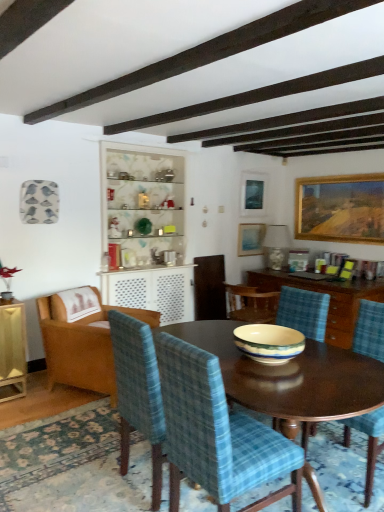
Question: Is white fabric lampshade at upper center taller or shorter than wooden cabinet at center?

Choices:
 (A) short
 (B) tall

Answer: (A)

Question: From a real-world perspective, is white fabric lampshade at upper center physically located above or below wooden cabinet at center?

Choices:
 (A) above
 (B) below

Answer: (A)

Question: Which is farther from the wooden table at center?

Choices:
 (A) blue plaid chair at center, the third chair from the left
 (B) wooden cabinet at center
 (C) white fabric lampshade at upper center
 (D) porcelain bowl at center
 (E) blue plaid chair at center, the 4th chair from the left

Answer: (C)

Question: Which object is positioned farthest from the blue plaid chair at center, the 4th chair from the left?

Choices:
 (A) white fabric lampshade at upper center
 (B) blue plaid chair at center, the third chair from the left
 (C) wooden armchair at left, the first chair viewed from the left
 (D) wooden table at center
 (E) matte blue picture frame at upper center, which ranks as the third picture frame in right-to-left order

Answer: (B)